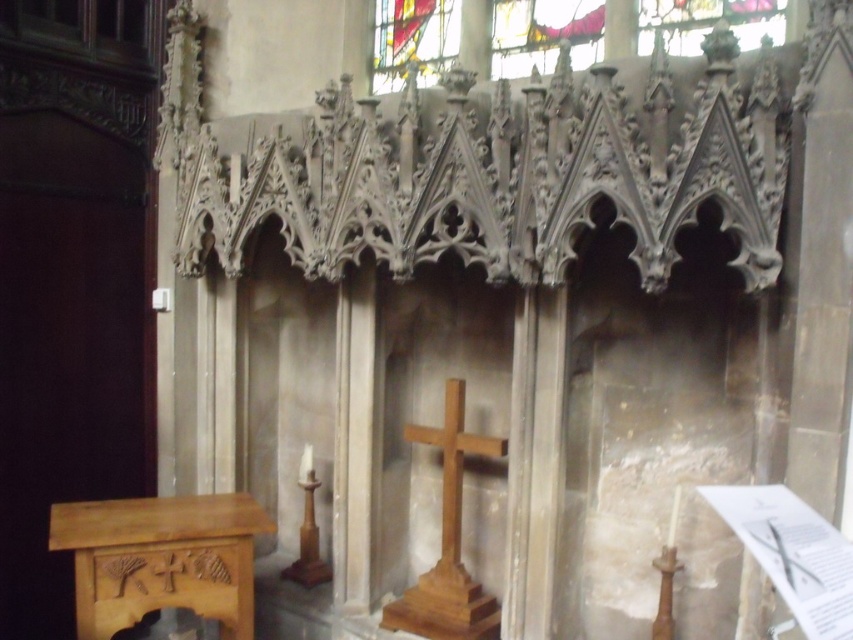
Does light brown polished wood altar at lower left have a greater height compared to wooden cross at center?

Incorrect, light brown polished wood altar at lower left's height is not larger of wooden cross at center's.

Between light brown polished wood altar at lower left and wooden cross at center, which one has less height?

Standing shorter between the two is light brown polished wood altar at lower left.

Does point (80, 630) come behind point (444, 420)?

No, (80, 630) is closer to viewer.

The height and width of the screenshot is (640, 853). I want to click on light brown polished wood altar at lower left, so click(x=161, y=557).

Does point (254, 522) come in front of point (552, 13)?

Yes.

Does light brown polished wood altar at lower left have a greater height compared to stained glass window at upper center?

No, light brown polished wood altar at lower left is not taller than stained glass window at upper center.

Is point (198, 582) behind point (695, 20)?

No.

Identify the location of light brown polished wood altar at lower left. This screenshot has height=640, width=853. (161, 557).

Between stained glass window at upper center and wooden cross at center, which one has less height?

stained glass window at upper center is shorter.

Describe the element at coordinates (543, 33) in the screenshot. I see `stained glass window at upper center` at that location.

Where is `stained glass window at upper center`? The height and width of the screenshot is (640, 853). stained glass window at upper center is located at coordinates (543, 33).